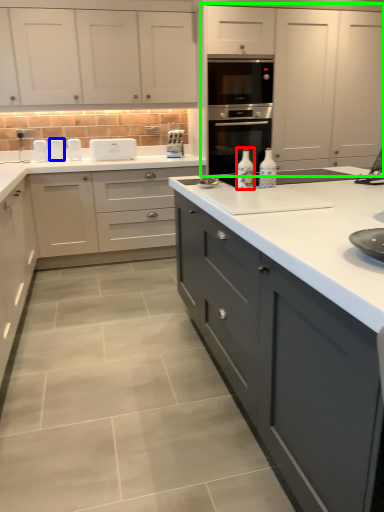
Question: Estimate the real-world distances between objects in this image. Which object is closer to bottle (highlighted by a red box), appliance (highlighted by a blue box) or cabinetry (highlighted by a green box)?

Choices:
 (A) appliance
 (B) cabinetry

Answer: (B)